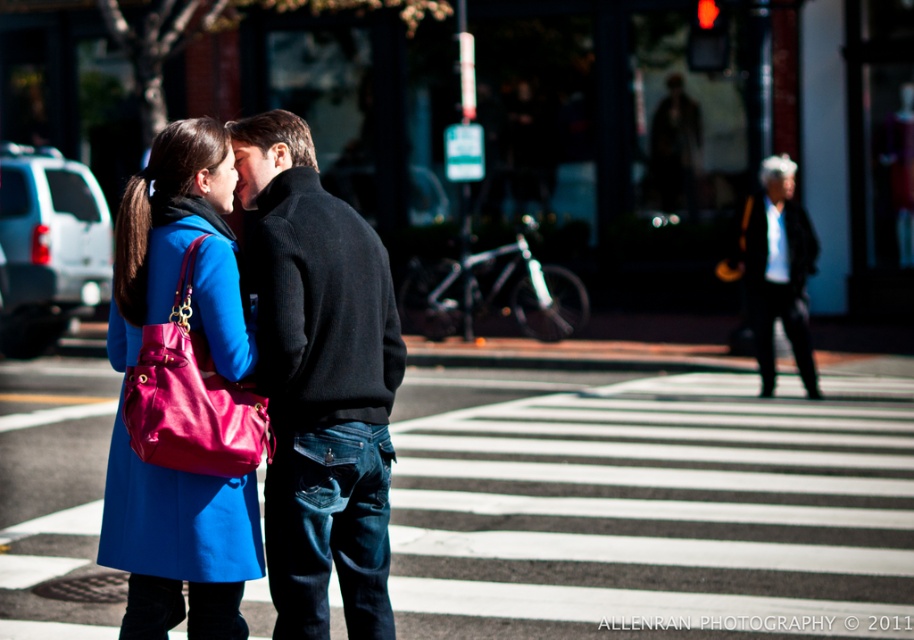
Question: Is black wool sweater at center below black wool coat at upper right?

Choices:
 (A) no
 (B) yes

Answer: (B)

Question: Estimate the real-world distances between objects in this image. Which object is farther from the matte blue coat at center?

Choices:
 (A) black wool coat at upper right
 (B) white shirt at center

Answer: (B)

Question: Which of the following is the closest to the observer?

Choices:
 (A) matte blue coat at center
 (B) white shirt at center
 (C) black wool coat at upper right
 (D) black wool coat at center

Answer: (A)

Question: Does black wool coat at center lie in front of black wool coat at upper right?

Choices:
 (A) yes
 (B) no

Answer: (A)

Question: Is matte blue coat at center positioned in front of black wool coat at center?

Choices:
 (A) yes
 (B) no

Answer: (A)

Question: Which is farther from the black wool coat at center?

Choices:
 (A) matte blue coat at center
 (B) white shirt at center
 (C) black wool coat at upper right
 (D) black wool sweater at center

Answer: (B)